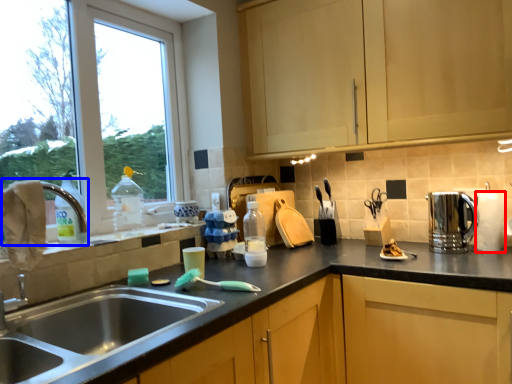
Question: Which object is closer to the camera taking this photo, paper towel (highlighted by a red box) or faucet (highlighted by a blue box)?

Choices:
 (A) paper towel
 (B) faucet

Answer: (B)